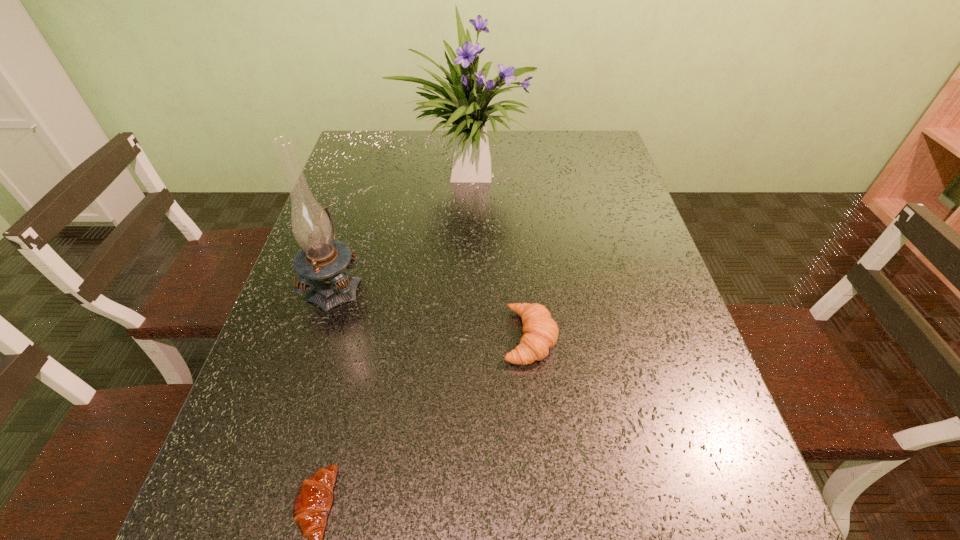
Locate an element on the screen. This screenshot has height=540, width=960. vacant space at the near edge of the desktop is located at coordinates (541, 525).

This screenshot has width=960, height=540. In the image, there is a desktop. Find the location of `vacant space at the left edge`. vacant space at the left edge is located at coordinates (301, 380).

Locate an element on the screen. blank space at the right edge of the desktop is located at coordinates (631, 387).

Find the location of a particular element. The width and height of the screenshot is (960, 540). free space at the far left corner of the desktop is located at coordinates (369, 148).

This screenshot has height=540, width=960. In order to click on vacant space at the far right corner of the desktop in this screenshot , I will do `click(619, 170)`.

Where is `vacant region between the flower arrangement and the oil lamp`? This screenshot has width=960, height=540. vacant region between the flower arrangement and the oil lamp is located at coordinates (400, 227).

Locate an element on the screen. This screenshot has width=960, height=540. free space that is in between the oil lamp and the flower arrangement is located at coordinates (400, 227).

Identify the location of empty space that is in between the flower arrangement and the oil lamp. (400, 227).

Select which object is the closest to the nearer crescent roll. Please provide its 2D coordinates. Your answer should be formatted as a tuple, i.e. [(x, y)], where the tuple contains the x and y coordinates of a point satisfying the conditions above.

[(320, 263)]

Select which object appears as the closest to the second shortest object. Please provide its 2D coordinates. Your answer should be formatted as a tuple, i.e. [(x, y)], where the tuple contains the x and y coordinates of a point satisfying the conditions above.

[(320, 263)]